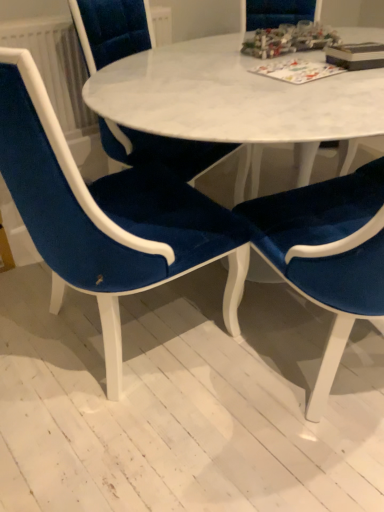
What are the coordinates of `free region on the left part of hardcover book at upper right, which is the 1th book in right-to-left order` in the screenshot? It's located at pyautogui.click(x=301, y=66).